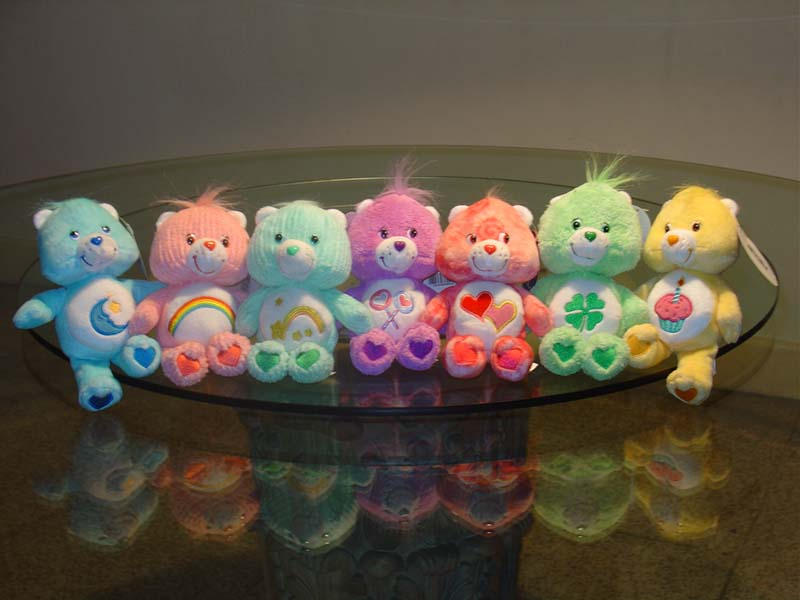
What are the coordinates of `starlight decoration` in the screenshot? It's located at point(304,310).